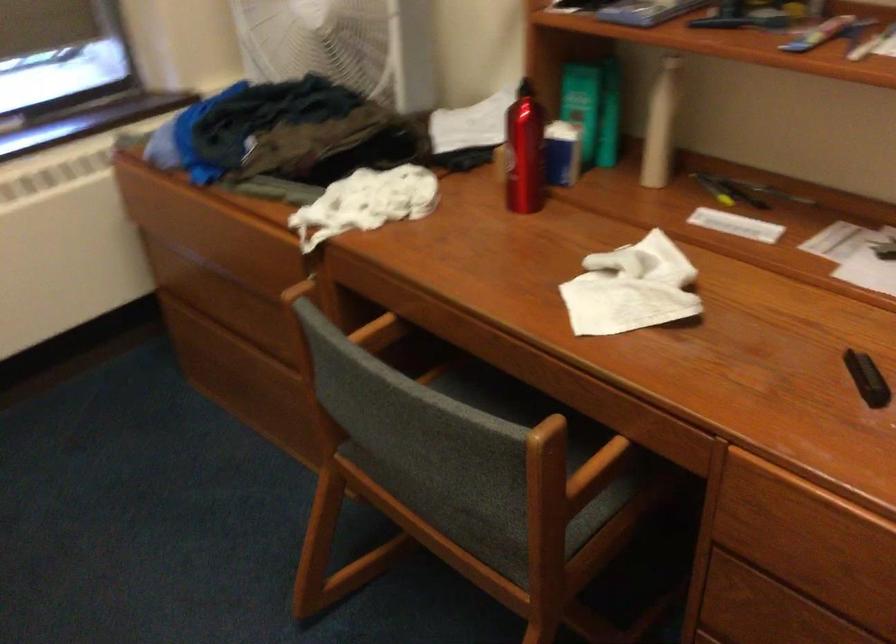
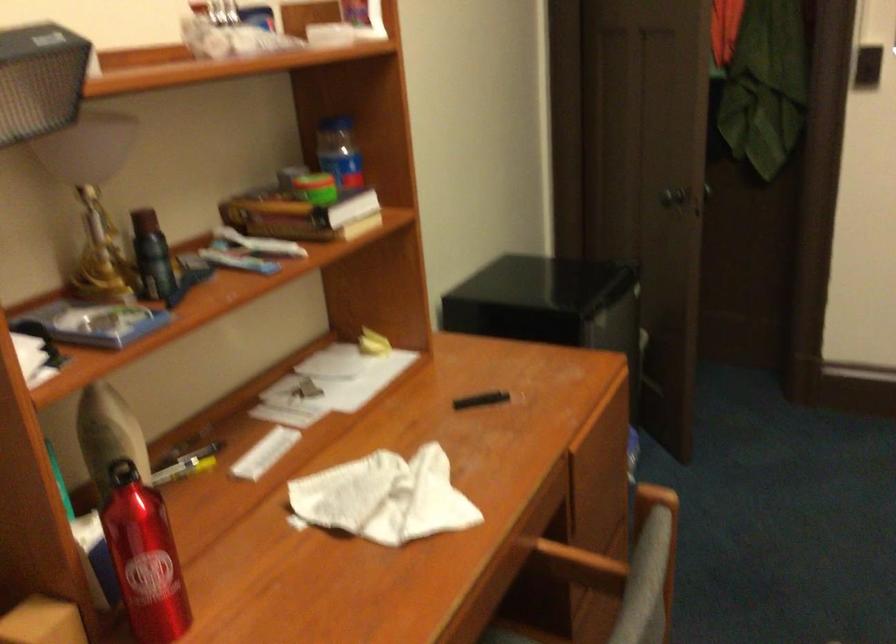
Where in the second image is the point corresponding to (x=587, y=468) from the first image?

(579, 565)